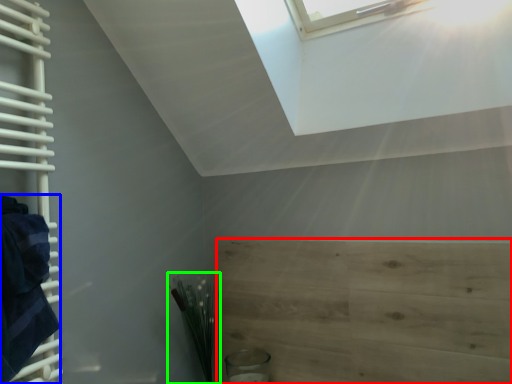
Question: Which object is the farthest from plywood (highlighted by a red box)? Choose among these: blanket (highlighted by a blue box) or plant (highlighted by a green box).

Choices:
 (A) blanket
 (B) plant

Answer: (A)